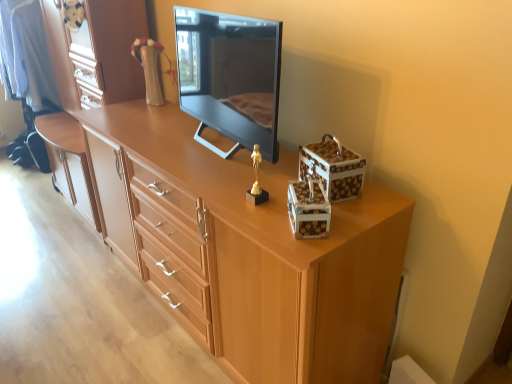
Question: Would you say white glossy storage box at upper right, marked as the second storage box in a back-to-front arrangement, is part of black glossy television at center's contents?

Choices:
 (A) no
 (B) yes

Answer: (A)

Question: Is black glossy television at center behind white glossy storage box at upper right, marked as the second storage box in a back-to-front arrangement?

Choices:
 (A) no
 (B) yes

Answer: (B)

Question: Is the depth of black glossy television at center less than that of white glossy storage box at upper right, marked as the second storage box in a back-to-front arrangement?

Choices:
 (A) yes
 (B) no

Answer: (B)

Question: Is black glossy television at center beside white glossy storage box at upper right, marked as the second storage box in a back-to-front arrangement?

Choices:
 (A) no
 (B) yes

Answer: (A)

Question: From the image's perspective, is black glossy television at center under white glossy storage box at upper right, the 1th storage box when ordered from front to back?

Choices:
 (A) no
 (B) yes

Answer: (A)

Question: Choose the correct answer: Is white glossy storage box at upper right, placed as the 1th storage box when sorted from back to front, inside light wood chest of drawers at center or outside it?

Choices:
 (A) inside
 (B) outside

Answer: (B)

Question: Looking at the image, does white glossy storage box at upper right, which is the 2th storage box in front-to-back order, seem bigger or smaller compared to light wood chest of drawers at center?

Choices:
 (A) big
 (B) small

Answer: (B)

Question: Is point (347, 178) positioned closer to the camera than point (221, 244)?

Choices:
 (A) farther
 (B) closer

Answer: (B)

Question: From the image's perspective, is white glossy storage box at upper right, which is the 2th storage box in front-to-back order, located above or below light wood chest of drawers at center?

Choices:
 (A) below
 (B) above

Answer: (B)

Question: Would you say light brown wood dresser at center is to the left or to the right of gold metallic statue at center in the picture?

Choices:
 (A) left
 (B) right

Answer: (A)

Question: Considering the positions of light brown wood dresser at center and gold metallic statue at center in the image, is light brown wood dresser at center wider or thinner than gold metallic statue at center?

Choices:
 (A) thin
 (B) wide

Answer: (B)

Question: Considering the positions of light brown wood dresser at center and gold metallic statue at center in the image, is light brown wood dresser at center taller or shorter than gold metallic statue at center?

Choices:
 (A) short
 (B) tall

Answer: (B)

Question: From the image's perspective, is light brown wood dresser at center above or below gold metallic statue at center?

Choices:
 (A) above
 (B) below

Answer: (A)

Question: Is light wood chest of drawers at center wider or thinner than light brown wood dresser at center?

Choices:
 (A) wide
 (B) thin

Answer: (B)

Question: Is light wood chest of drawers at center spatially inside light brown wood dresser at center, or outside of it?

Choices:
 (A) inside
 (B) outside

Answer: (B)